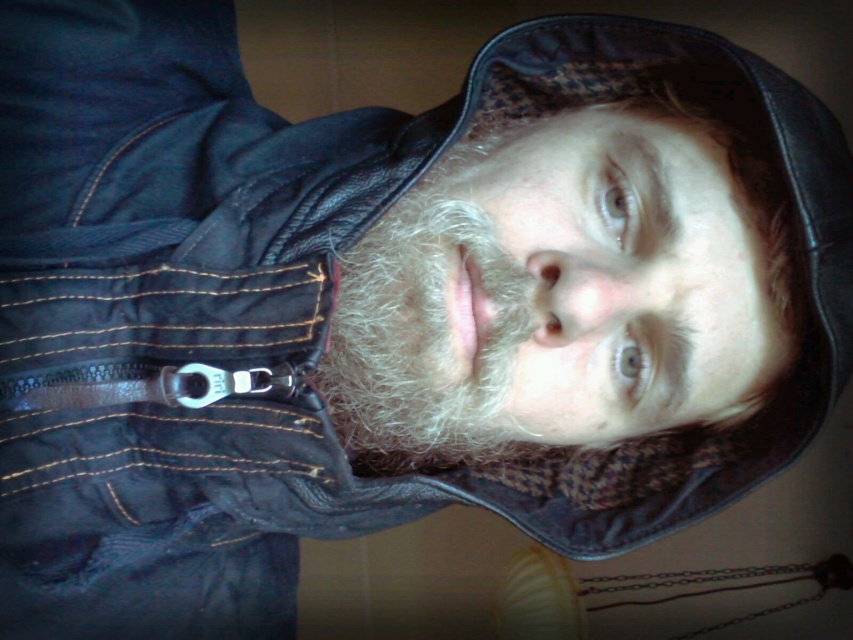
Which is behind, point (677, 384) or point (453, 160)?

The point (453, 160) is behind.

Can you confirm if light brown textured hair at center is positioned to the left of white fuzzy beard at center?

Incorrect, light brown textured hair at center is not on the left side of white fuzzy beard at center.

Who is more distant from viewer, (426, 355) or (345, 420)?

The point (345, 420) is more distant.

You are a GUI agent. You are given a task and a screenshot of the screen. Output one action in this format:
    pyautogui.click(x=<x>, y=<y>)
    Task: Click on the light brown textured hair at center
    This screenshot has width=853, height=640.
    Given the screenshot: What is the action you would take?
    pyautogui.click(x=567, y=280)